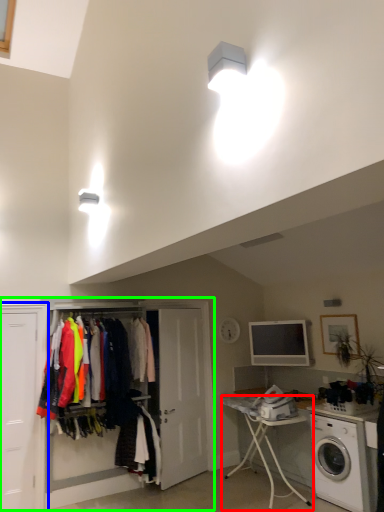
Question: Which is farther away from table (highlighted by a red box)? door (highlighted by a blue box) or armoire (highlighted by a green box)?

Choices:
 (A) door
 (B) armoire

Answer: (A)